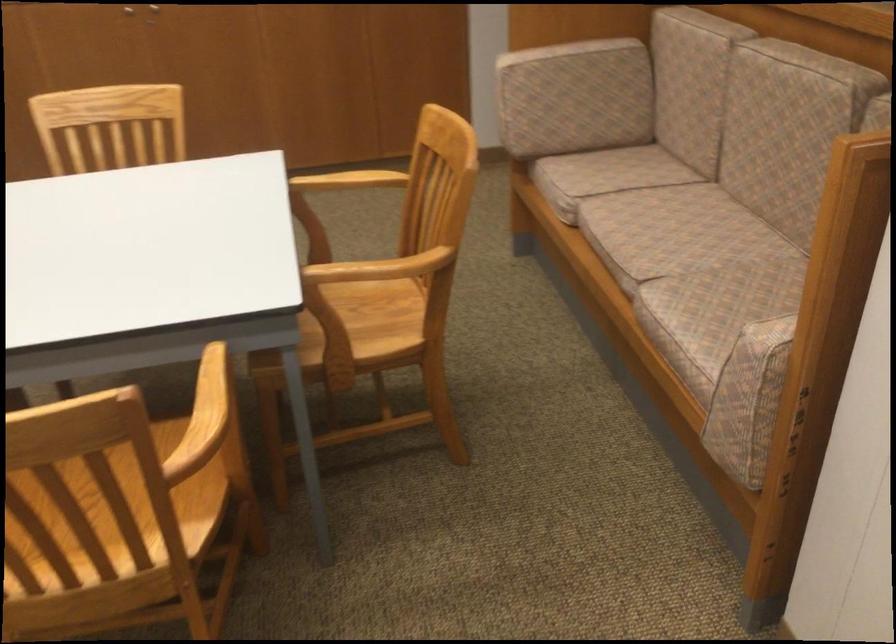
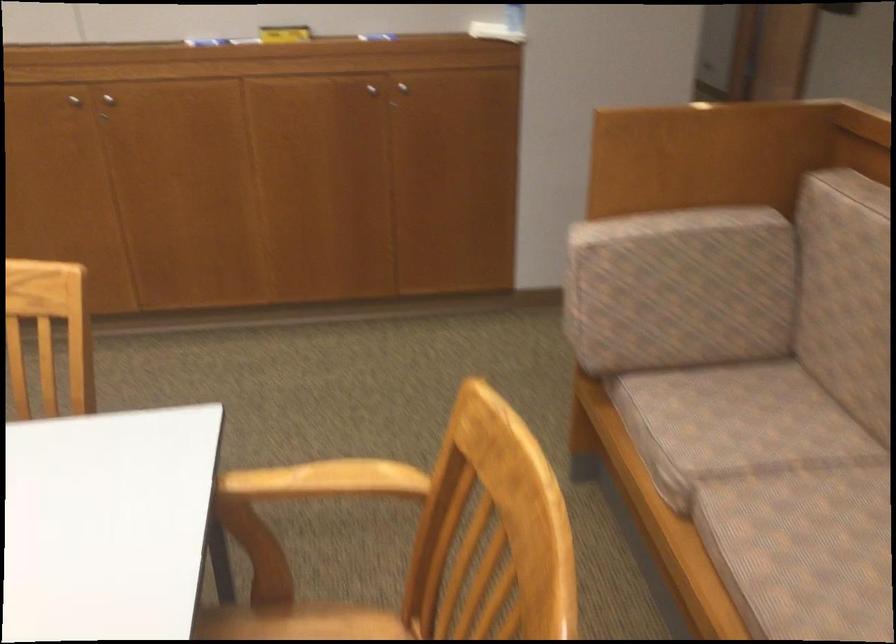
Question: What movement of the cameraman would produce the second image?

Choices:
 (A) Left
 (B) Right
 (C) Forward
 (D) Backward

Answer: (C)